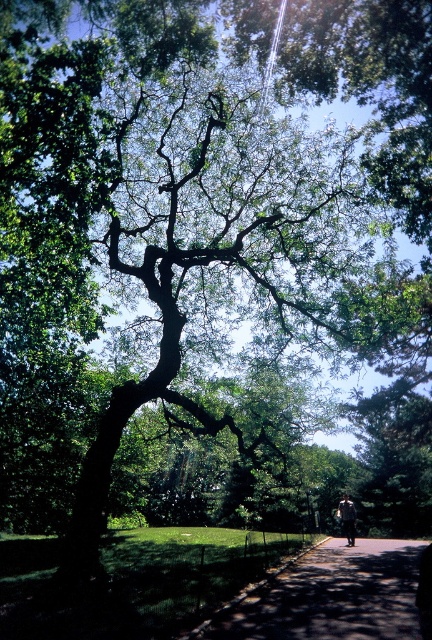
Question: Which point is farther to the camera?

Choices:
 (A) (295, 595)
 (B) (346, 531)

Answer: (B)

Question: Is paved asphalt path at center smaller than camouflage fabric man at center?

Choices:
 (A) yes
 (B) no

Answer: (B)

Question: Considering the relative positions of paved asphalt path at center and camouflage fabric man at center in the image provided, where is paved asphalt path at center located with respect to camouflage fabric man at center?

Choices:
 (A) right
 (B) left

Answer: (B)

Question: Does paved asphalt path at center appear over camouflage fabric man at center?

Choices:
 (A) no
 (B) yes

Answer: (B)